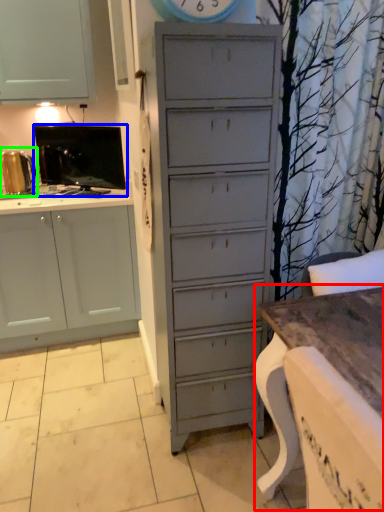
Question: Which object is positioned farthest from table (highlighted by a red box)? Select from appliance (highlighted by a blue box) and appliance (highlighted by a green box).

Choices:
 (A) appliance
 (B) appliance

Answer: (B)